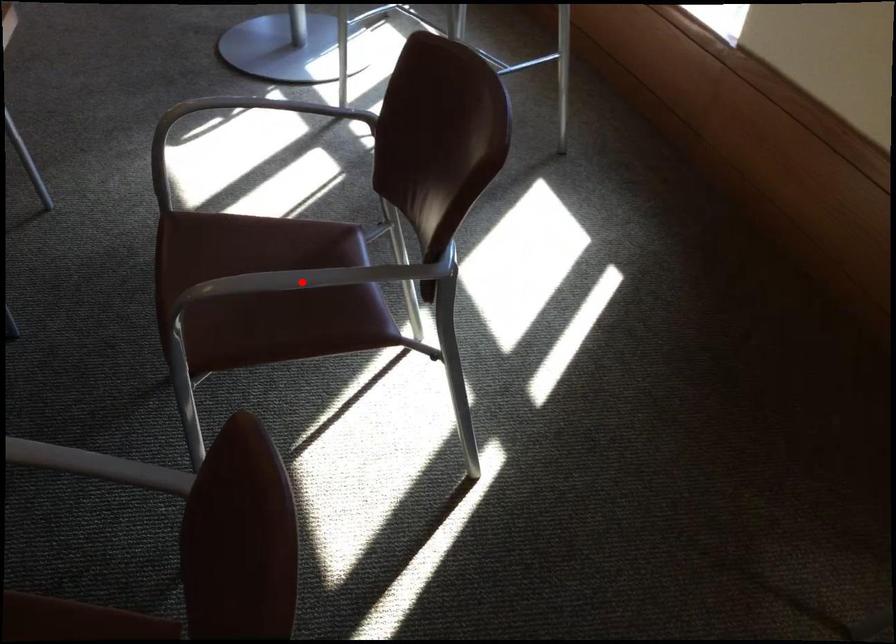
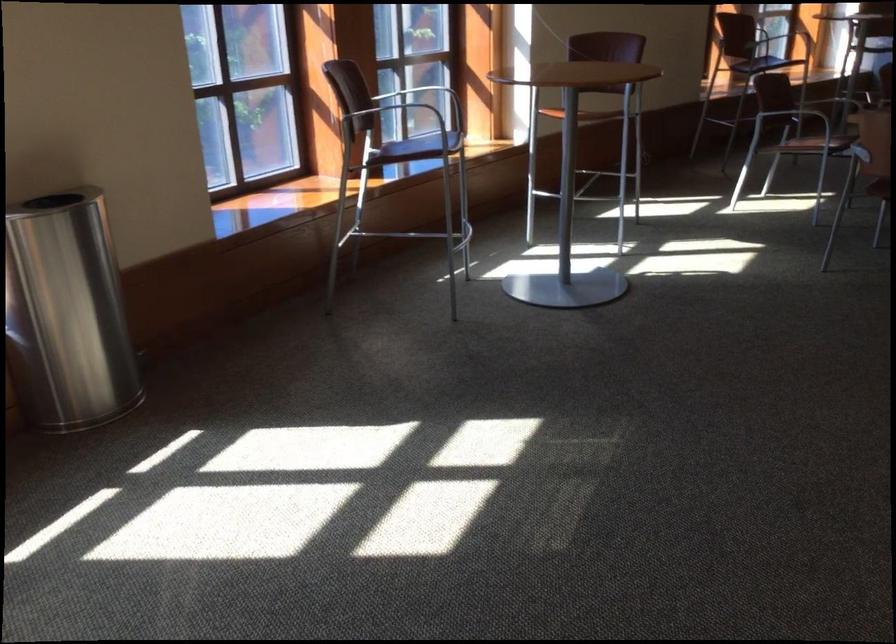
Question: I am providing you with two images of the same scene from different viewpoints. A red point is marked on the first image. Is the red point's position out of view in image 2?

Choices:
 (A) Yes
 (B) No

Answer: (A)